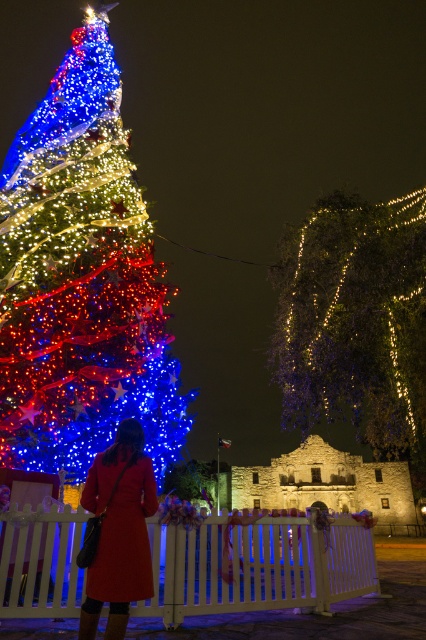
Is point (74, 122) farther from camera compared to point (121, 618)?

Yes, point (74, 122) is farther from viewer.

From the picture: Does shiny metallic christmas tree at left have a lesser height compared to matte red coat at lower left?

No, shiny metallic christmas tree at left is not shorter than matte red coat at lower left.

You are a GUI agent. You are given a task and a screenshot of the screen. Output one action in this format:
    pyautogui.click(x=<x>, y=<y>)
    Task: Click on the shiny metallic christmas tree at left
    
    Given the screenshot: What is the action you would take?
    pyautogui.click(x=80, y=280)

Between illuminated string lights at upper right and matte red coat at lower left, which one is positioned lower?

matte red coat at lower left is below.

Which is above, illuminated string lights at upper right or matte red coat at lower left?

illuminated string lights at upper right is above.

Locate an element on the screen. This screenshot has width=426, height=640. illuminated string lights at upper right is located at coordinates (356, 323).

This screenshot has height=640, width=426. What are the coordinates of `illuminated string lights at upper right` in the screenshot? It's located at (356, 323).

Is illuminated string lights at upper right positioned in front of white wooden fence at center?

No, illuminated string lights at upper right is further to the viewer.

Which is more to the left, illuminated string lights at upper right or white wooden fence at center?

white wooden fence at center is more to the left.

Identify the location of illuminated string lights at upper right. Image resolution: width=426 pixels, height=640 pixels. (356, 323).